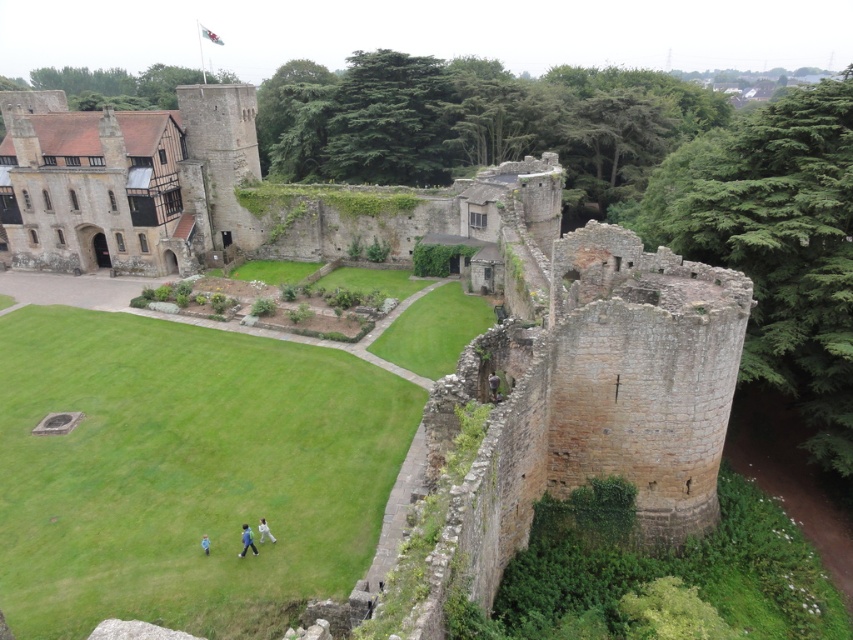
Between brown stone fort at left and white fabric at center, which one appears on the right side from the viewer's perspective?

white fabric at center

Can you confirm if brown stone fort at left is smaller than white fabric at center?

Incorrect, brown stone fort at left is not smaller in size than white fabric at center.

This screenshot has height=640, width=853. I want to click on brown stone fort at left, so click(x=123, y=180).

Between point (498, 401) and point (202, 540), which one is positioned behind?

The point (498, 401) is more distant.

The width and height of the screenshot is (853, 640). What do you see at coordinates (492, 387) in the screenshot?
I see `brown leather jacket at center` at bounding box center [492, 387].

Locate an element on the screen. The width and height of the screenshot is (853, 640). brown leather jacket at center is located at coordinates (492, 387).

Locate an element on the screen. The image size is (853, 640). brown leather jacket at center is located at coordinates (492, 387).

Can you confirm if brown stone fort at left is shorter than brown leather jacket at center?

No, brown stone fort at left is not shorter than brown leather jacket at center.

Who is higher up, brown stone fort at left or brown leather jacket at center?

brown stone fort at left

You are a GUI agent. You are given a task and a screenshot of the screen. Output one action in this format:
    pyautogui.click(x=<x>, y=<y>)
    Task: Click on the brown stone fort at left
    
    Given the screenshot: What is the action you would take?
    pyautogui.click(x=123, y=180)

Find the location of a particular element. brown stone fort at left is located at coordinates (123, 180).